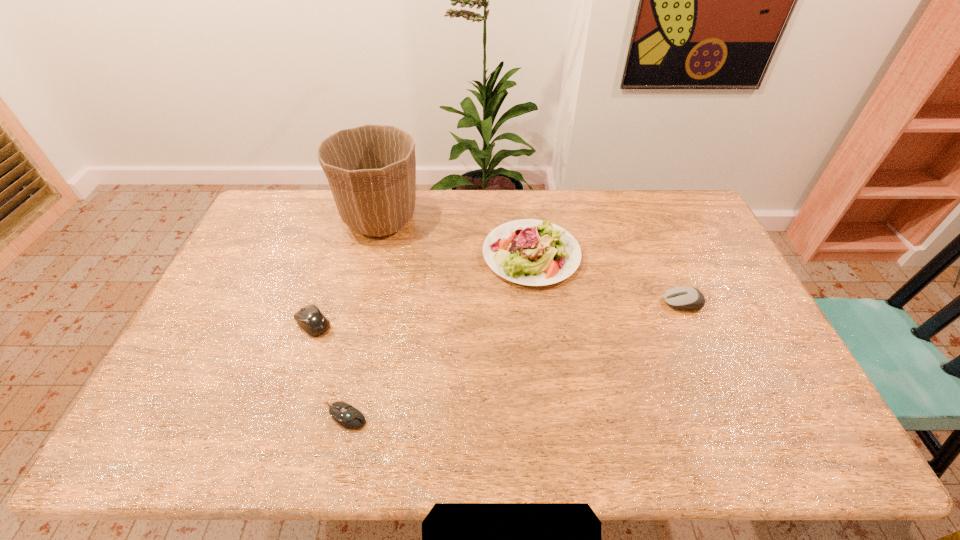
The image size is (960, 540). I want to click on vacant space at the right edge of the desktop, so click(x=745, y=323).

Where is `vacant space at the far right corner of the desktop`? The image size is (960, 540). vacant space at the far right corner of the desktop is located at coordinates (671, 196).

Locate an element on the screen. free space between the flowerpot and the leftmost computer mouse is located at coordinates (347, 271).

This screenshot has height=540, width=960. Identify the location of free spot between the shortest computer mouse and the tallest object. (363, 317).

Locate an element on the screen. free area in between the second computer mouse from right to left and the fourth shortest object is located at coordinates (439, 335).

Locate an element on the screen. The width and height of the screenshot is (960, 540). free spot between the fourth object from left to right and the rightmost object is located at coordinates (607, 279).

Find the location of `empty location between the leftmost computer mouse and the second computer mouse from right to left`. empty location between the leftmost computer mouse and the second computer mouse from right to left is located at coordinates (329, 369).

At what (x,y) coordinates should I click in order to perform the action: click on vacant area that lies between the rightmost object and the salad plate. Please return your answer as a coordinate pair (x, y). Looking at the image, I should click on (607, 279).

The width and height of the screenshot is (960, 540). What are the coordinates of `free space between the leftmost computer mouse and the salad plate` in the screenshot? It's located at (422, 289).

I want to click on free space that is in between the rightmost computer mouse and the leftmost computer mouse, so click(498, 313).